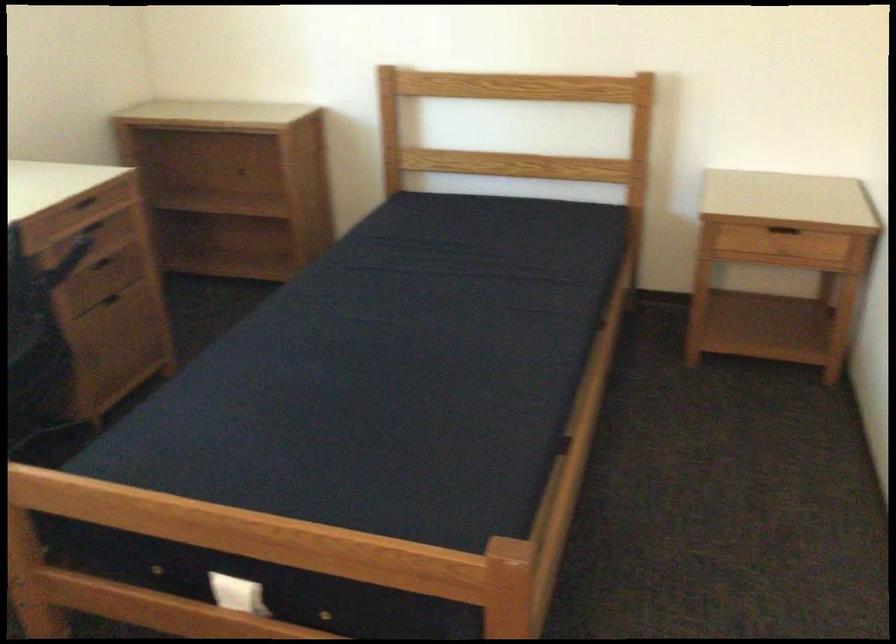
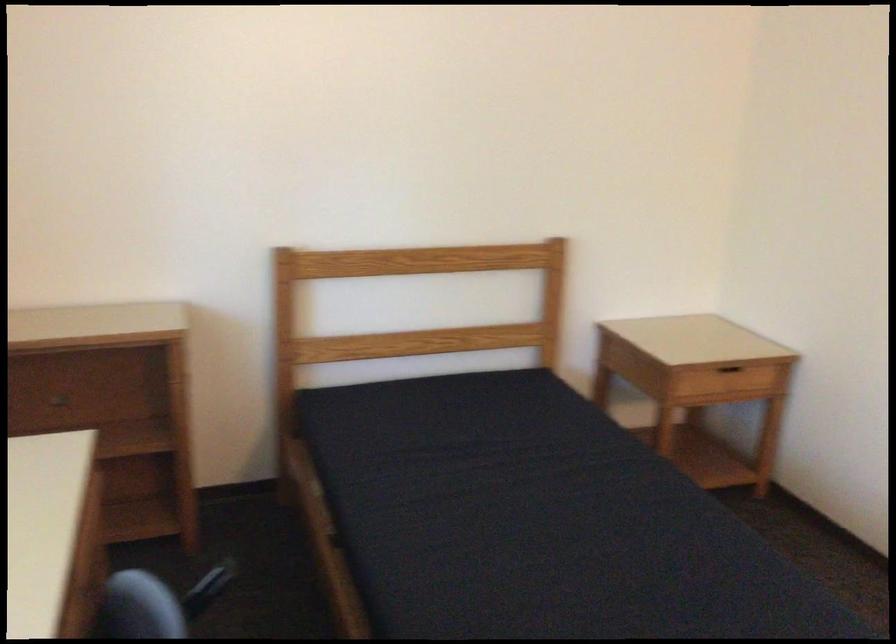
Find the pixel in the second image that matches pixel 759 223 in the first image.

(727, 368)